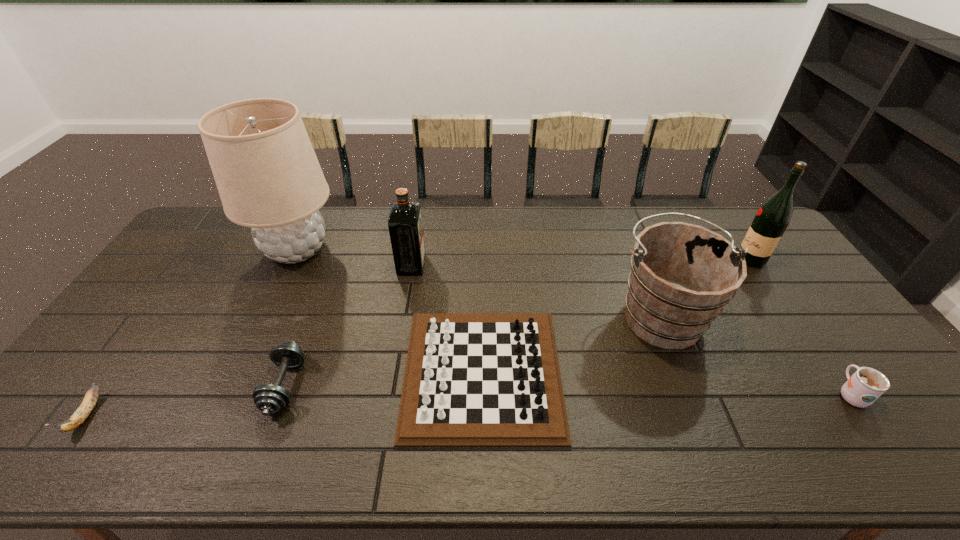
You are a GUI agent. You are given a task and a screenshot of the screen. Output one action in this format:
    pyautogui.click(x=<x>, y=<y>)
    Task: Click on the vacant space situated 0.340m on the front-facing side of the second tallest object
    This screenshot has height=540, width=960.
    Given the screenshot: What is the action you would take?
    pyautogui.click(x=636, y=260)

You are a GUI agent. You are given a task and a screenshot of the screen. Output one action in this format:
    pyautogui.click(x=<x>, y=<y>)
    Task: Click on the free space located on the front-facing side of the second tallest object
    The height and width of the screenshot is (540, 960).
    Given the screenshot: What is the action you would take?
    pyautogui.click(x=669, y=260)

Identify the location of free space located on the front-facing side of the second tallest object. (719, 260).

I want to click on vacant area situated 0.340m on the front label of the shorter liquor, so click(527, 265).

What are the coordinates of `vacant space positioned on the handle side of the third object from right to left` in the screenshot? It's located at (628, 230).

Identify the location of free point located 0.390m on the handle side of the third object from right to left. (619, 209).

Find the location of a particular element. The image size is (960, 540). free space located 0.170m on the handle side of the third object from right to left is located at coordinates (634, 245).

Identify the location of free space located 0.320m on the side with the handle of the cup. (x=778, y=291).

At what (x,y) coordinates should I click in order to perform the action: click on vacant space located on the side with the handle of the cup. Please return your answer as a coordinate pair (x, y). The width and height of the screenshot is (960, 540). Looking at the image, I should click on (781, 295).

Where is `vacant space located 0.270m on the side with the handle of the cup`? Image resolution: width=960 pixels, height=540 pixels. vacant space located 0.270m on the side with the handle of the cup is located at coordinates (786, 302).